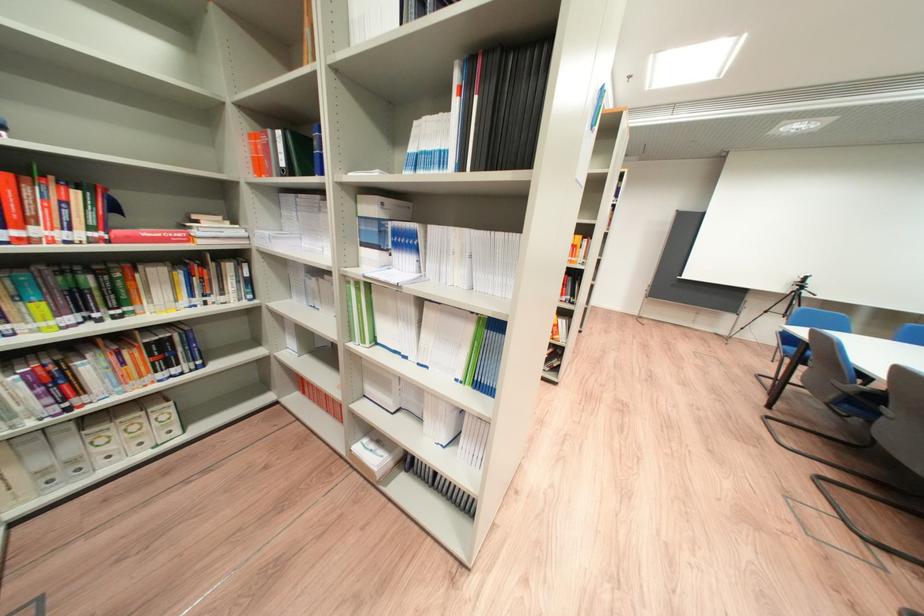
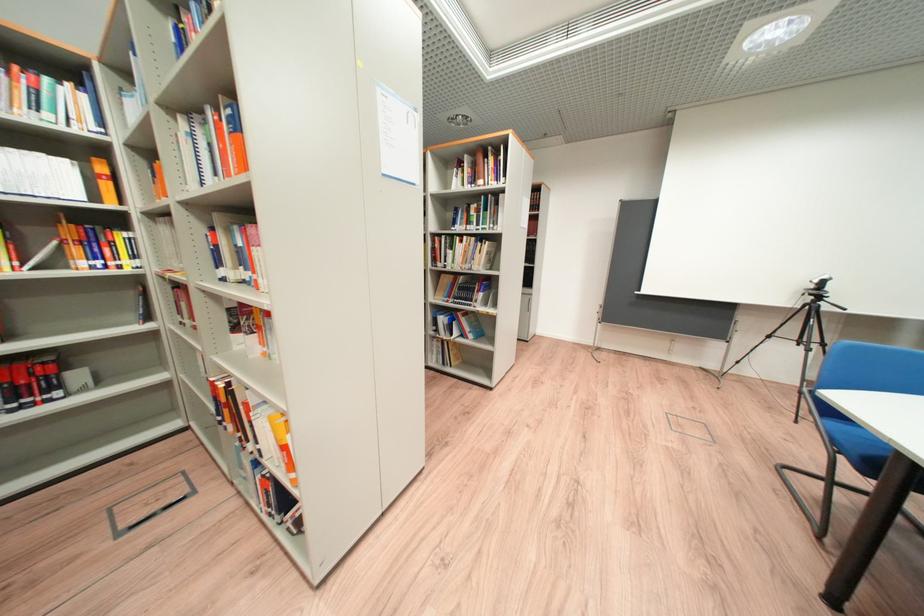
What movement of the cameraman would produce the second image?

The cameraman walked toward right, forward.